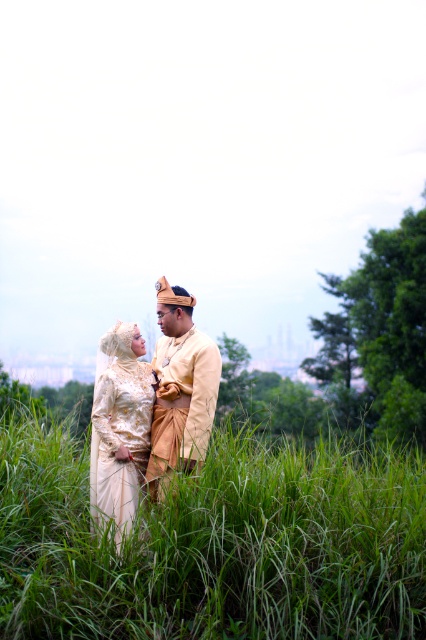
Question: Which object appears farthest from the camera in this image?

Choices:
 (A) matte gold dress at center
 (B) green grassy at center
 (C) matte gold suit at center

Answer: (C)

Question: In this image, where is green grassy at center located relative to golden silk dress at center?

Choices:
 (A) below
 (B) above

Answer: (A)

Question: Which of the following is the closest to the observer?

Choices:
 (A) golden silk dress at center
 (B) matte gold suit at center
 (C) matte gold dress at center

Answer: (C)

Question: Does green grassy at center appear on the left side of matte gold suit at center?

Choices:
 (A) no
 (B) yes

Answer: (B)

Question: Is green grassy at center smaller than golden silk dress at center?

Choices:
 (A) yes
 (B) no

Answer: (B)

Question: Which object is positioned closest to the green grassy at center?

Choices:
 (A) matte gold dress at center
 (B) golden silk dress at center

Answer: (B)